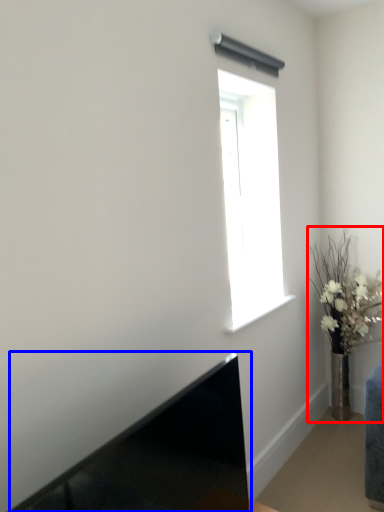
Question: Which object appears farthest to the camera in this image, houseplant (highlighted by a red box) or laptop (highlighted by a blue box)?

Choices:
 (A) houseplant
 (B) laptop

Answer: (A)